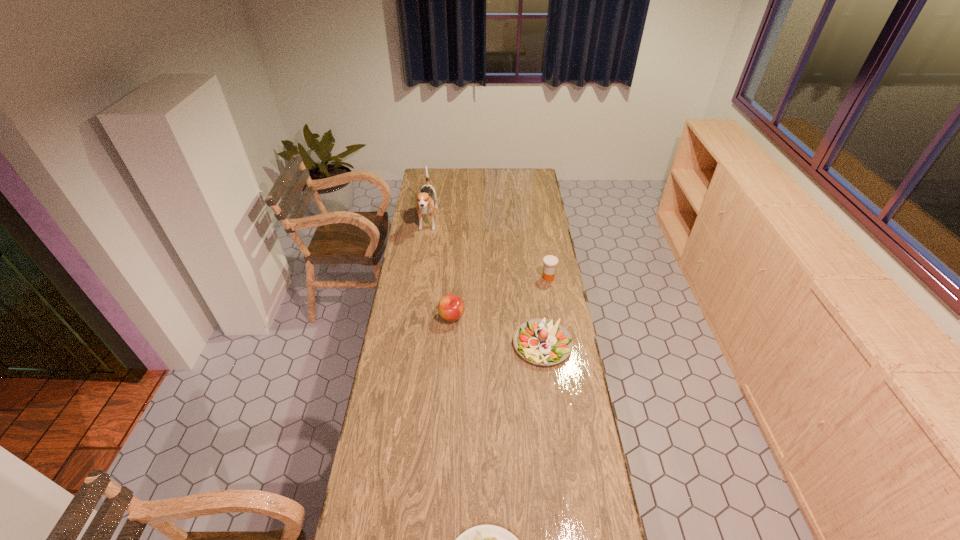
Locate an element on the screen. free space that satisfies the following two spatial constraints: 1. at the face of the leftmost object; 2. on the left side of the farther salad plate is located at coordinates (410, 344).

This screenshot has height=540, width=960. Identify the location of vacant space that satisfies the following two spatial constraints: 1. on the label of the medicine; 2. on the front side of the taller salad plate. (560, 344).

The height and width of the screenshot is (540, 960). In order to click on vacant space that satisfies the following two spatial constraints: 1. at the face of the puppy; 2. on the left side of the taller salad plate in this screenshot , I will do `click(410, 344)`.

Where is `vacant area that satisfies the following two spatial constraints: 1. on the front side of the taller salad plate; 2. on the left side of the apple`? Image resolution: width=960 pixels, height=540 pixels. vacant area that satisfies the following two spatial constraints: 1. on the front side of the taller salad plate; 2. on the left side of the apple is located at coordinates (450, 344).

The width and height of the screenshot is (960, 540). What are the coordinates of `free space in the image that satisfies the following two spatial constraints: 1. at the face of the leftmost object; 2. on the left side of the apple` in the screenshot? It's located at (414, 316).